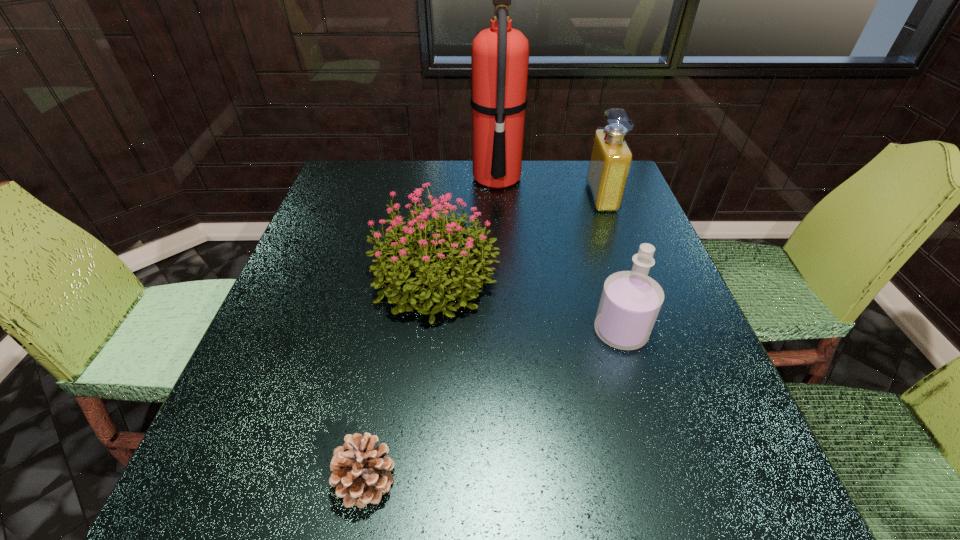
At what (x,y) coordinates should I click in order to perform the action: click on vacant space situated on the front-facing side of the farther perfume. Please return your answer as a coordinate pair (x, y). The width and height of the screenshot is (960, 540). Looking at the image, I should click on (529, 197).

Where is `vacant space situated on the front-facing side of the farther perfume`? vacant space situated on the front-facing side of the farther perfume is located at coordinates (497, 197).

In order to click on free space located on the front of the bouquet in this screenshot , I will do `click(420, 420)`.

The height and width of the screenshot is (540, 960). In order to click on vacant space located on the left of the nearer perfume in this screenshot , I will do `click(559, 332)`.

Locate an element on the screen. The image size is (960, 540). blank area located on the back of the pinecone is located at coordinates (383, 390).

Find the location of a particular element. The width and height of the screenshot is (960, 540). fire extinguisher that is at the far edge is located at coordinates (500, 54).

Locate an element on the screen. perfume located at the far edge is located at coordinates (611, 158).

Find the location of `object that is at the near edge`. object that is at the near edge is located at coordinates (361, 473).

Find the location of a particular element. The image size is (960, 540). object positioned at the far right corner is located at coordinates (611, 158).

I want to click on vacant space at the far edge, so click(576, 204).